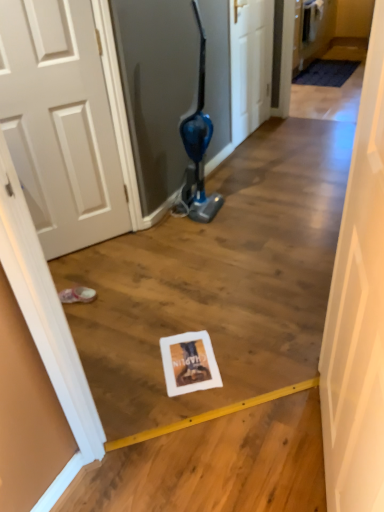
I want to click on vacant space behind pink fabric footwear at lower left, so [x=95, y=273].